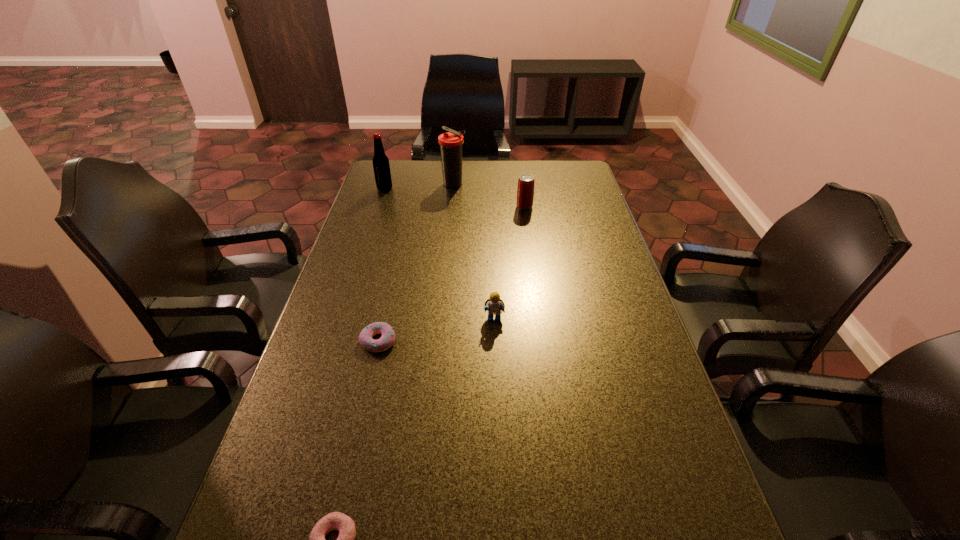
Locate an element on the screen. Image resolution: width=960 pixels, height=540 pixels. vacant area between the farther doughnut and the fourth farthest object is located at coordinates (436, 330).

Locate an element on the screen. Image resolution: width=960 pixels, height=540 pixels. unoccupied position between the third object from right to left and the beer bottle is located at coordinates (420, 187).

This screenshot has width=960, height=540. Find the location of `free space between the beer bottle and the Lego`. free space between the beer bottle and the Lego is located at coordinates (440, 254).

At what (x,y) coordinates should I click in order to perform the action: click on vacant space in between the third shortest object and the beer can. Please return your answer as a coordinate pair (x, y). Looking at the image, I should click on click(510, 263).

At what (x,y) coordinates should I click in order to perform the action: click on free space between the fifth farthest object and the rightmost object. Please return your answer as a coordinate pair (x, y). Looking at the image, I should click on (451, 274).

At what (x,y) coordinates should I click in order to perform the action: click on vacant point located between the fifth object from left to right and the thermos bottle. Please return your answer as a coordinate pair (x, y). This screenshot has width=960, height=540. Looking at the image, I should click on (474, 252).

Image resolution: width=960 pixels, height=540 pixels. Find the location of `free space between the third nearest object and the fifth farthest object`. free space between the third nearest object and the fifth farthest object is located at coordinates (436, 330).

Find the location of a particular element. vacant point located between the thermos bottle and the beer bottle is located at coordinates (420, 187).

Where is `free space between the thermos bottle and the beer bottle`? free space between the thermos bottle and the beer bottle is located at coordinates (420, 187).

Where is `object that ranks as the closest to the farther doughnut`? The image size is (960, 540). object that ranks as the closest to the farther doughnut is located at coordinates pos(494,305).